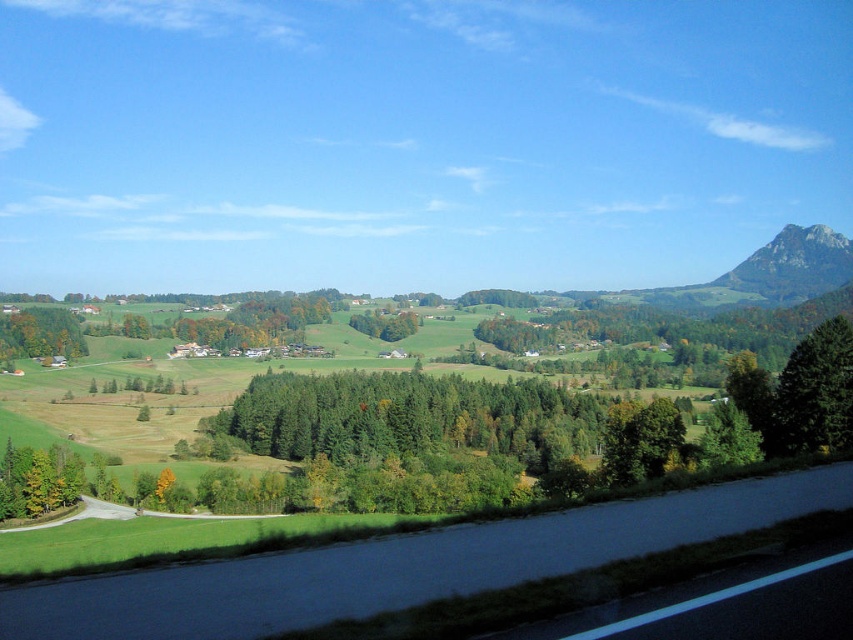
Question: Which point is closer to the camera?

Choices:
 (A) (840, 406)
 (B) (839, 273)
 (C) (57, 342)

Answer: (A)

Question: Does black asphalt road at lower center have a larger size compared to rugged granite peak at upper right?

Choices:
 (A) no
 (B) yes

Answer: (A)

Question: In this image, where is black asphalt road at lower center located relative to rugged granite peak at upper right?

Choices:
 (A) right
 (B) left

Answer: (B)

Question: Among these points, which one is farthest from the camera?

Choices:
 (A) (631, 500)
 (B) (39, 340)

Answer: (B)

Question: Does black asphalt road at lower center have a larger size compared to rugged granite peak at upper right?

Choices:
 (A) no
 (B) yes

Answer: (A)

Question: Which object is closer to the camera taking this photo?

Choices:
 (A) green matte tree at center
 (B) green matte tree at lower left
 (C) green matte tree at center-right
 (D) rugged granite peak at upper right

Answer: (C)